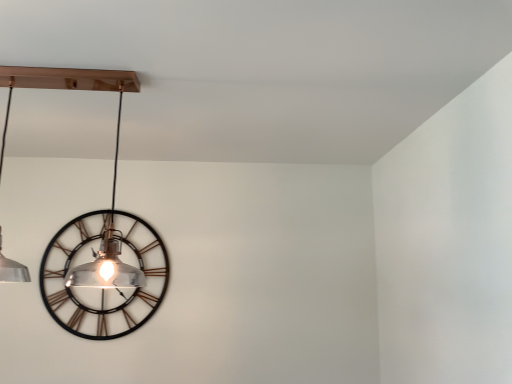
Question: Should I look upward or downward to see clear glass pendant light at center?

Choices:
 (A) down
 (B) up

Answer: (B)

Question: Does metallic black clock at left have a lesser height compared to clear glass pendant light at center?

Choices:
 (A) no
 (B) yes

Answer: (A)

Question: Is metallic black clock at left next to clear glass pendant light at center?

Choices:
 (A) no
 (B) yes

Answer: (B)

Question: Are metallic black clock at left and clear glass pendant light at center far apart?

Choices:
 (A) yes
 (B) no

Answer: (B)

Question: Is clear glass pendant light at center at the back of metallic black clock at left?

Choices:
 (A) yes
 (B) no

Answer: (B)

Question: Can you confirm if metallic black clock at left is smaller than clear glass pendant light at center?

Choices:
 (A) no
 (B) yes

Answer: (B)

Question: Considering the relative sizes of metallic black clock at left and clear glass pendant light at center in the image provided, is metallic black clock at left taller than clear glass pendant light at center?

Choices:
 (A) no
 (B) yes

Answer: (B)

Question: From a real-world perspective, is clear glass pendant light at center physically below metallic black clock at left?

Choices:
 (A) yes
 (B) no

Answer: (B)

Question: Does clear glass pendant light at center appear on the left side of metallic black clock at left?

Choices:
 (A) yes
 (B) no

Answer: (B)

Question: Does clear glass pendant light at center contain metallic black clock at left?

Choices:
 (A) yes
 (B) no

Answer: (B)

Question: Is clear glass pendant light at center at the right side of metallic black clock at left?

Choices:
 (A) no
 (B) yes

Answer: (B)

Question: Considering the relative sizes of clear glass pendant light at center and metallic black clock at left in the image provided, is clear glass pendant light at center smaller than metallic black clock at left?

Choices:
 (A) no
 (B) yes

Answer: (A)

Question: Does clear glass pendant light at center lie in front of metallic black clock at left?

Choices:
 (A) yes
 (B) no

Answer: (A)

Question: From the image's perspective, is clear glass pendant light at center located above or below metallic black clock at left?

Choices:
 (A) above
 (B) below

Answer: (A)